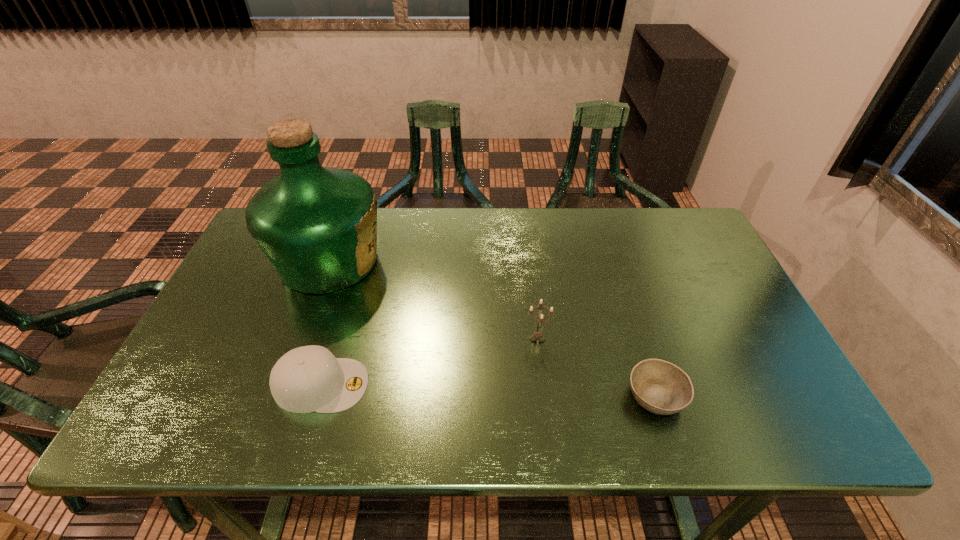
Identify the location of the farthest object. The image size is (960, 540). (317, 226).

I want to click on liquor, so click(317, 226).

Where is `the third object from left to right`? The width and height of the screenshot is (960, 540). the third object from left to right is located at coordinates point(537,335).

This screenshot has height=540, width=960. In order to click on the third shortest object in this screenshot , I will do `click(537, 335)`.

You are a GUI agent. You are given a task and a screenshot of the screen. Output one action in this format:
    pyautogui.click(x=<x>, y=<y>)
    Task: Click on the third tallest object
    The width and height of the screenshot is (960, 540).
    Given the screenshot: What is the action you would take?
    pyautogui.click(x=309, y=378)

Where is `the shortest object`? Image resolution: width=960 pixels, height=540 pixels. the shortest object is located at coordinates (660, 387).

The image size is (960, 540). Find the location of `the rightmost object`. the rightmost object is located at coordinates (660, 387).

Identify the location of free space located on the label side of the tallest object. (521, 261).

At what (x,y) coordinates should I click in order to perform the action: click on free point located on the back of the third shortest object. Please return your answer as a coordinate pair (x, y). This screenshot has width=960, height=540. Looking at the image, I should click on (529, 271).

I want to click on free spot located on the front-facing side of the second shortest object, so click(x=535, y=384).